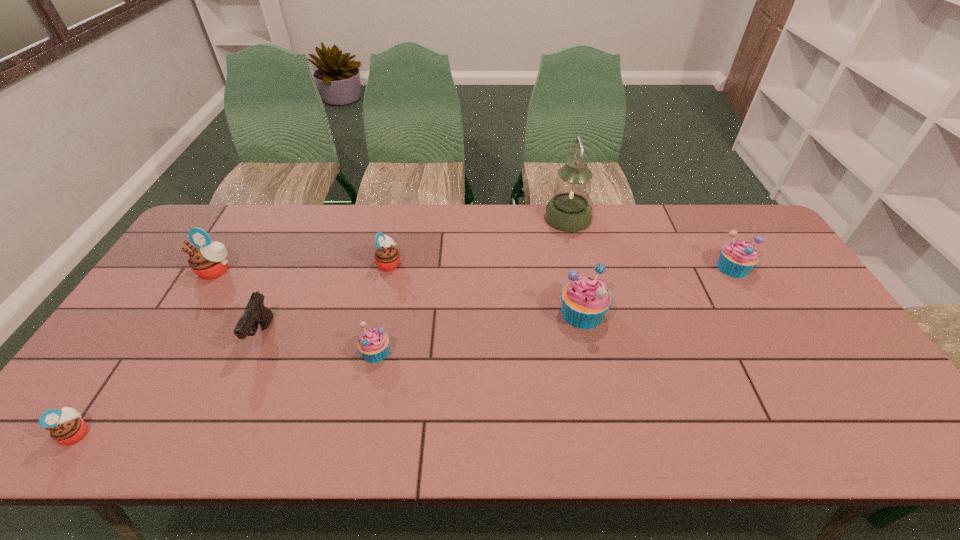
Locate an element on the screen. free space located 0.060m at the barrel of the pistol is located at coordinates (244, 377).

The height and width of the screenshot is (540, 960). I want to click on free point located on the right of the second nearest muffin, so click(x=526, y=352).

Find the location of a particular element. This screenshot has height=540, width=960. free space located 0.210m on the front-facing side of the leftmost object is located at coordinates (183, 433).

The height and width of the screenshot is (540, 960). In order to click on object at the far edge in this screenshot , I will do `click(569, 210)`.

The width and height of the screenshot is (960, 540). Identify the location of object located at the near edge. (66, 427).

Image resolution: width=960 pixels, height=540 pixels. I want to click on object located at the right edge, so click(737, 259).

Identify the location of object at the near left corner. This screenshot has width=960, height=540. (66, 427).

Identify the location of free space at the far edge of the desktop. This screenshot has height=540, width=960. (534, 238).

Identify the location of free space at the near edge of the desktop. (780, 420).

Where is `free space at the left edge of the desktop`? The height and width of the screenshot is (540, 960). free space at the left edge of the desktop is located at coordinates (138, 390).